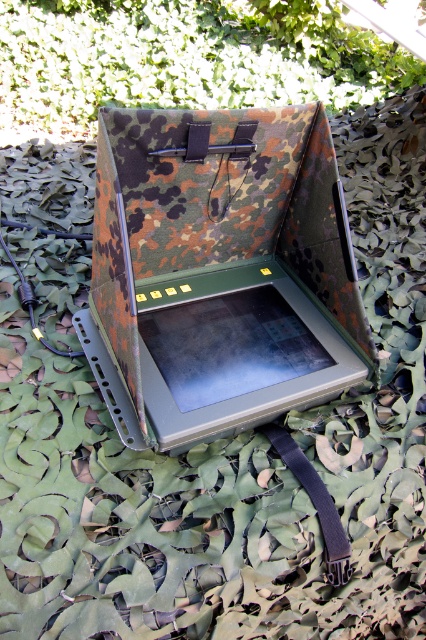
Question: Does camo fabric laptop at center lie in front of matte black tablet at center?

Choices:
 (A) no
 (B) yes

Answer: (B)

Question: Which point appears farthest from the camera in this image?

Choices:
 (A) (221, 323)
 (B) (175, 445)

Answer: (A)

Question: Does matte black tablet at center appear under black fabric strap at center?

Choices:
 (A) no
 (B) yes

Answer: (A)

Question: Which of the following is the farthest from the observer?

Choices:
 (A) (278, 381)
 (B) (267, 426)

Answer: (B)

Question: Can you confirm if camo fabric laptop at center is positioned to the right of black fabric strap at center?

Choices:
 (A) yes
 (B) no

Answer: (B)

Question: Among these points, which one is farthest from the camera?

Choices:
 (A) (218, 355)
 (B) (311, 472)
 (C) (183, 435)

Answer: (A)